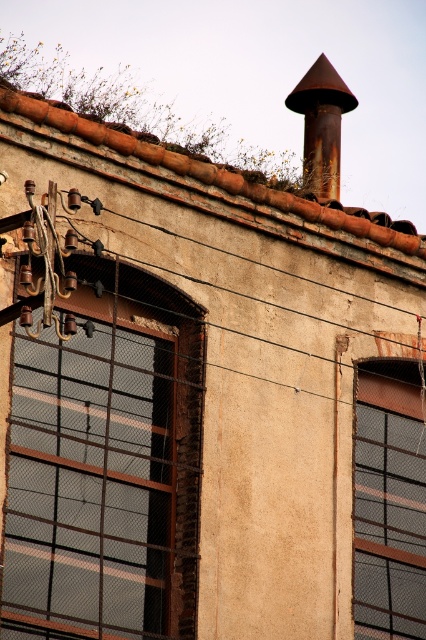
Question: Which of the following is the farthest from the observer?

Choices:
 (A) brown metal window at left
 (B) rusty metal roof at upper center
 (C) matte glass window at center

Answer: (C)

Question: Which object is farther from the camera taking this photo?

Choices:
 (A) rusty metal roof at upper center
 (B) brown metal window at left
 (C) rusty metal chimney at upper center

Answer: (C)

Question: Can you confirm if rusty metal roof at upper center is bigger than rusty metal chimney at upper center?

Choices:
 (A) yes
 (B) no

Answer: (B)

Question: Which is farther from the rusty metal roof at upper center?

Choices:
 (A) matte glass window at center
 (B) rusty metal chimney at upper center

Answer: (A)

Question: Does brown metal window at left appear on the right side of rusty metal chimney at upper center?

Choices:
 (A) no
 (B) yes

Answer: (A)

Question: In this image, where is rusty metal roof at upper center located relative to rusty metal chimney at upper center?

Choices:
 (A) left
 (B) right

Answer: (A)